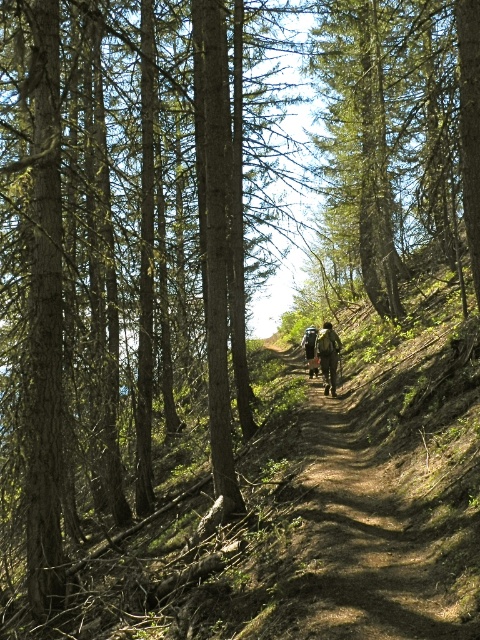
Locate an element on the screen. brown dirt path at center is located at coordinates (359, 545).

Is brown dirt path at center thinner than camouflage fabric backpack at center?

In fact, brown dirt path at center might be wider than camouflage fabric backpack at center.

What do you see at coordinates (359, 545) in the screenshot? This screenshot has width=480, height=640. I see `brown dirt path at center` at bounding box center [359, 545].

Locate an element on the screen. Image resolution: width=480 pixels, height=640 pixels. brown dirt path at center is located at coordinates (x=359, y=545).

In the scene shown: Is camouflage fabric backpacks at center smaller than camouflage fabric backpack at center?

Yes, camouflage fabric backpacks at center is smaller than camouflage fabric backpack at center.

Between camouflage fabric backpacks at center and camouflage fabric backpack at center, which one has less height?

Standing shorter between the two is camouflage fabric backpacks at center.

Does point (314, 337) come farther from viewer compared to point (310, 336)?

No, (314, 337) is in front of (310, 336).

Image resolution: width=480 pixels, height=640 pixels. In order to click on camouflage fabric backpacks at center in this screenshot , I will do `click(323, 355)`.